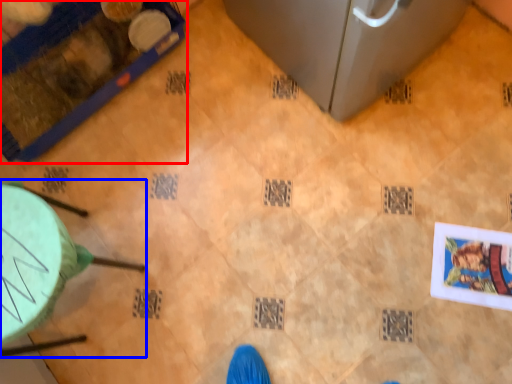
Question: Which of the following is the closest to the observer, furniture (highlighted by a red box) or furniture (highlighted by a blue box)?

Choices:
 (A) furniture
 (B) furniture

Answer: (B)